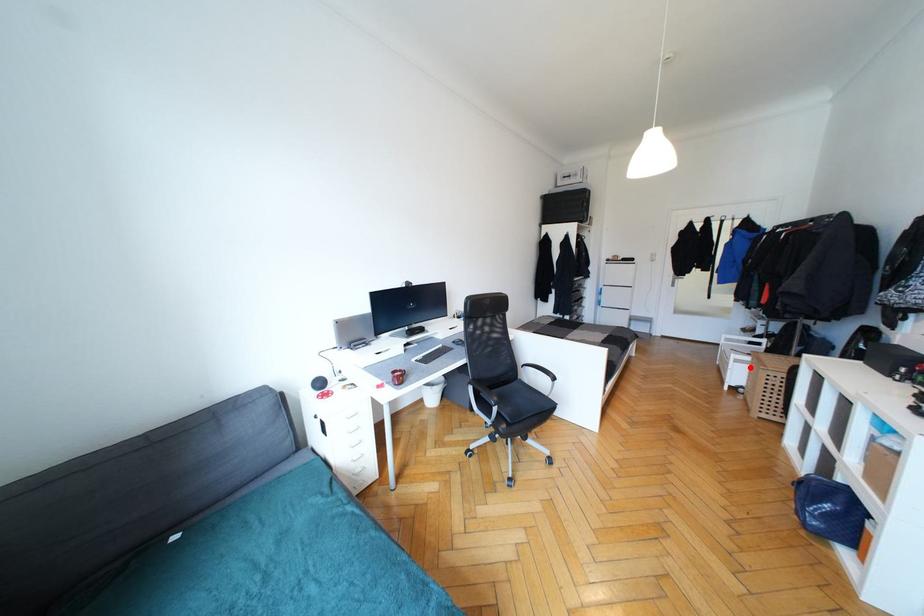
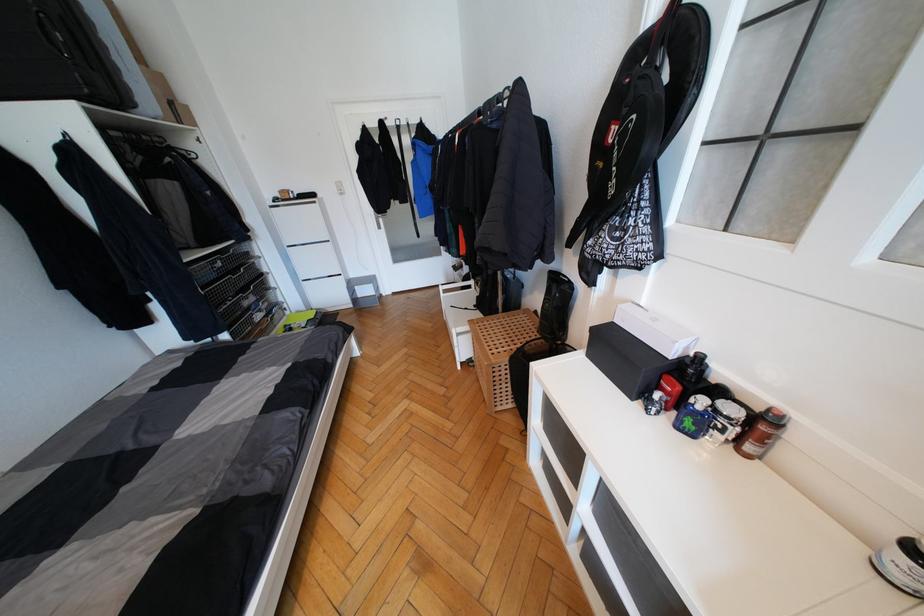
Question: I am providing you with two images of the same scene from different viewpoints. Given a red point in image1, look at the same physical point in image2. Is it:

Choices:
 (A) Closer to the viewpoint
 (B) Farther from the viewpoint

Answer: (B)